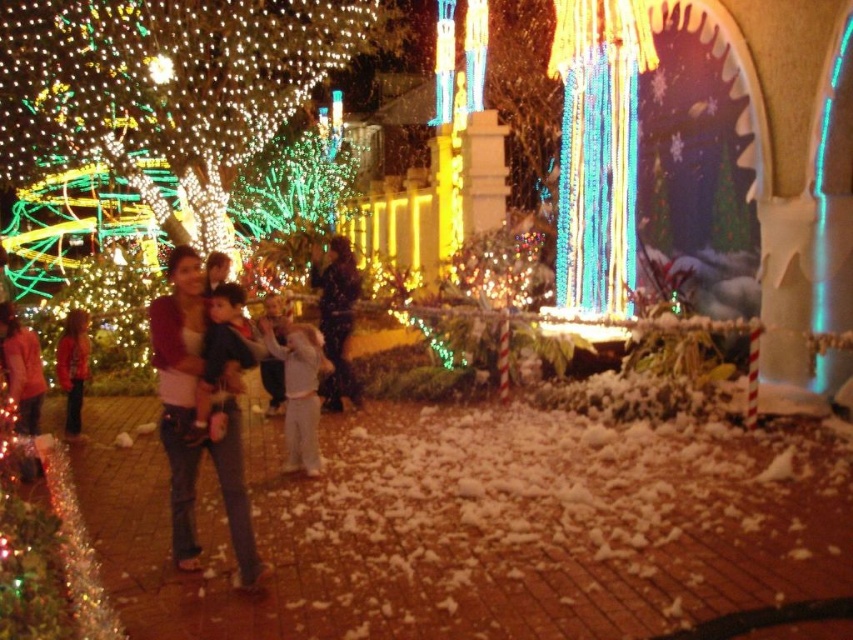
What do you see at coordinates (194, 417) in the screenshot? The height and width of the screenshot is (640, 853). I see `denim jeans at center` at bounding box center [194, 417].

Is denim jeans at center wider than red cotton sweater at left?

Yes.

Identify the location of denim jeans at center. The image size is (853, 640). (194, 417).

Locate an element on the screen. denim jeans at center is located at coordinates (194, 417).

Which is in front, point (173, 440) or point (291, 410)?

Point (173, 440) is in front.

Is point (161, 378) farther from viewer compared to point (294, 330)?

No, (161, 378) is in front of (294, 330).

Identify the location of denim jeans at center. This screenshot has height=640, width=853. (194, 417).

Is white cotton pants at center positioned at the back of red cotton sweater at left?

No, white cotton pants at center is closer to the viewer.

Based on the photo, is white cotton pants at center wider than red cotton sweater at left?

Incorrect, white cotton pants at center's width does not surpass red cotton sweater at left's.

Does point (303, 468) come farther from viewer compared to point (76, 378)?

No.

Identify the location of white cotton pants at center. (299, 390).